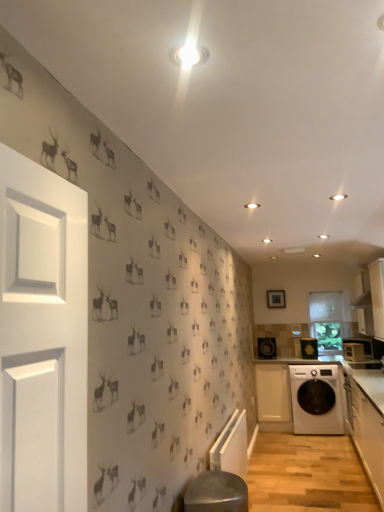
Question: Relative to white matte cabinet at lower right, the third cabinetry when ordered from front to back, is white glossy microwave at right, which is the first appliance in front-to-back order, in front or behind?

Choices:
 (A) front
 (B) behind

Answer: (A)

Question: Is white glossy microwave at right, marked as the first appliance in a right-to-left arrangement, to the left or to the right of white matte cabinet at lower right, acting as the first cabinetry starting from the back, in the image?

Choices:
 (A) right
 (B) left

Answer: (A)

Question: Which is farther from the white glossy cabinetry at lower right, which appears as the 3th cabinetry when viewed from the back?

Choices:
 (A) white glossy washing machine at lower right
 (B) white glossy washing machine at lower right, positioned as the 2th appliance in back-to-front order
 (C) white matte cabinet at lower right, the third cabinetry when ordered from front to back
 (D) metallic stool at lower center
 (E) white glossy microwave at right, arranged as the 3th appliance when viewed from the back

Answer: (D)

Question: Estimate the real-world distances between objects in this image. Which object is farther from the white glossy cabinetry at lower right, which appears as the 3th cabinetry when viewed from the back?

Choices:
 (A) white glossy washing machine at lower right, positioned as the 2th appliance in back-to-front order
 (B) white glossy washing machine at lower right
 (C) white glossy microwave at right, which is the first appliance in front-to-back order
 (D) black plastic speaker at center, marked as the 1th appliance in a back-to-front arrangement
 (E) metallic stool at lower center

Answer: (E)